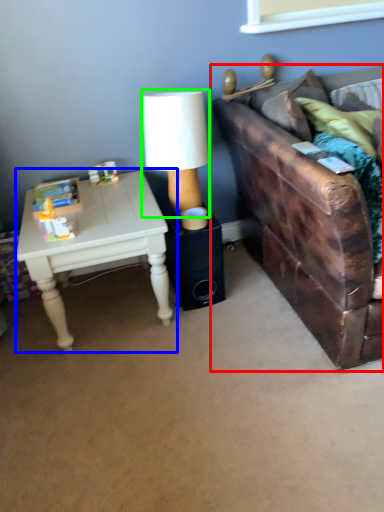
Question: Based on their relative distances, which object is nearer to studio couch (highlighted by a red box)? Choose from table (highlighted by a blue box) and table lamp (highlighted by a green box).

Choices:
 (A) table
 (B) table lamp

Answer: (B)